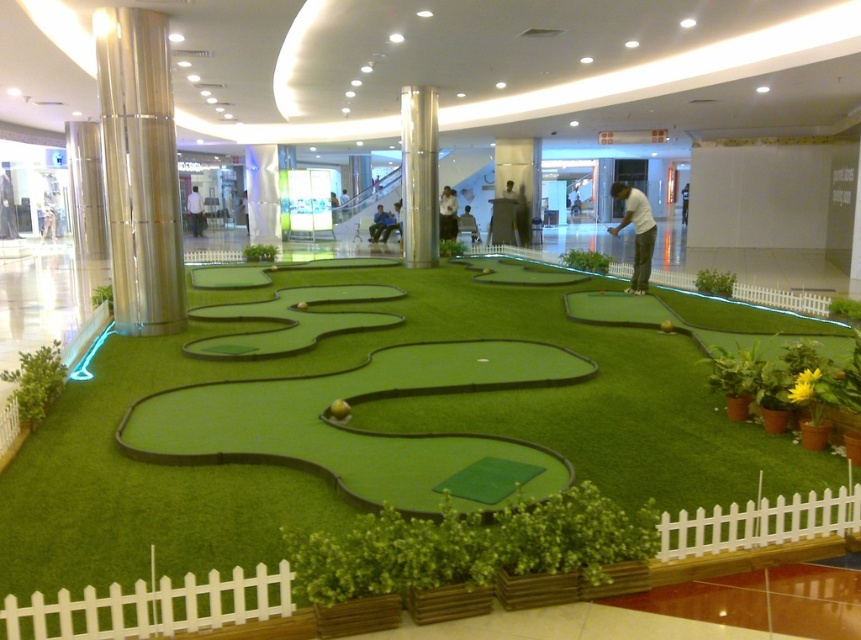
You are a mini golf player holding the white matte golf club at center. You want to hit the ball to the nearest hole, which is located behind the metallic silver pillar at center. Can you reach the pillar from your current position without moving your feet?

The metallic silver pillar at center is 4.67 meters away from the white matte golf club at center. Since the distance is over 4 meters, you cannot reach the pillar without moving your feet.

You are standing at the entrance of the mini golf course and want to hit the ball to the hole located at point (139, 170). However, there is a silver metallic pillar at left. Will your ball pass through the pillar if you aim directly at the hole?

The point (139, 170) is on the silver metallic pillar at left, so the ball will hit the pillar if you aim directly at that point.

You are playing mini golf and want to hit the ball from point A to point B. You are standing at point A, which is at coordinate point (426, 218), and you want to hit the ball to point B at coordinate point (651, 243). Considering the perspective of the camera, will the ball need to travel towards the camera or away from it to reach point B?

The ball needs to travel away from the camera to reach point B because point A at coordinate point (426, 218) is further to the camera than point B at coordinate point (651, 243).